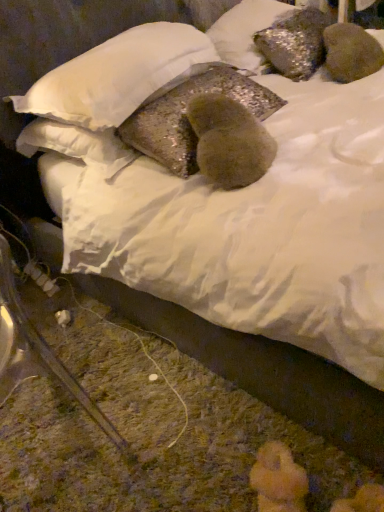
What are the coordinates of `glittery fabric pillow at center, the 3th pillow in the top-to-bottom sequence` in the screenshot? It's located at (186, 118).

Image resolution: width=384 pixels, height=512 pixels. In order to click on sparkly metallic pillow at upper center, which is counted as the 1th pillow, starting from the top in this screenshot , I will do `click(245, 32)`.

Considering the relative positions of sparkly metallic pillow at upper center, the 3th pillow positioned from the bottom, and shiny metallic pillow at center, the 2th pillow when ordered from top to bottom, in the image provided, is sparkly metallic pillow at upper center, the 3th pillow positioned from the bottom, behind shiny metallic pillow at center, the 2th pillow when ordered from top to bottom,?

Yes, sparkly metallic pillow at upper center, the 3th pillow positioned from the bottom, is further from the camera.

Does sparkly metallic pillow at upper center, the 3th pillow positioned from the bottom, have a lesser width compared to shiny metallic pillow at center, which is the second pillow from bottom to top?

Yes.

From a real-world perspective, is sparkly metallic pillow at upper center, which is counted as the 1th pillow, starting from the top, physically located above or below shiny metallic pillow at center, the 2th pillow when ordered from top to bottom?

sparkly metallic pillow at upper center, which is counted as the 1th pillow, starting from the top, is situated lower than shiny metallic pillow at center, the 2th pillow when ordered from top to bottom, in the real world.

Considering the sizes of objects sparkly metallic pillow at upper center, the 3th pillow positioned from the bottom, and shiny metallic pillow at center, the 2th pillow when ordered from top to bottom, in the image provided, who is shorter, sparkly metallic pillow at upper center, the 3th pillow positioned from the bottom, or shiny metallic pillow at center, the 2th pillow when ordered from top to bottom,?

With less height is shiny metallic pillow at center, the 2th pillow when ordered from top to bottom.

Is sparkly metallic pillow at upper center, the 3th pillow positioned from the bottom, thinner than glittery fabric pillow at center, marked as the first pillow in a bottom-to-top arrangement?

In fact, sparkly metallic pillow at upper center, the 3th pillow positioned from the bottom, might be wider than glittery fabric pillow at center, marked as the first pillow in a bottom-to-top arrangement.

Is sparkly metallic pillow at upper center, which is counted as the 1th pillow, starting from the top, positioned with its back to glittery fabric pillow at center, the 3th pillow in the top-to-bottom sequence?

No, sparkly metallic pillow at upper center, which is counted as the 1th pillow, starting from the top, is not facing away from glittery fabric pillow at center, the 3th pillow in the top-to-bottom sequence.

Which point is more forward, (x=239, y=55) or (x=167, y=93)?

The point (x=167, y=93) is more forward.

Which of these two, sparkly metallic pillow at upper center, which is counted as the 1th pillow, starting from the top, or glittery fabric pillow at center, the 3th pillow in the top-to-bottom sequence, is smaller?

glittery fabric pillow at center, the 3th pillow in the top-to-bottom sequence, is smaller.

Does point (232, 89) lie behind point (82, 123)?

Yes.

From their relative heights in the image, would you say glittery fabric pillow at center, marked as the first pillow in a bottom-to-top arrangement, is taller or shorter than shiny metallic pillow at center, the 2th pillow when ordered from top to bottom?

Considering their sizes, glittery fabric pillow at center, marked as the first pillow in a bottom-to-top arrangement, has more height than shiny metallic pillow at center, the 2th pillow when ordered from top to bottom.

Between glittery fabric pillow at center, marked as the first pillow in a bottom-to-top arrangement, and shiny metallic pillow at center, which is the second pillow from bottom to top, which one is positioned behind?

glittery fabric pillow at center, marked as the first pillow in a bottom-to-top arrangement, is further away from the camera.

Can we say glittery fabric pillow at center, the 3th pillow in the top-to-bottom sequence, lies outside shiny metallic pillow at center, which is the second pillow from bottom to top?

Absolutely, glittery fabric pillow at center, the 3th pillow in the top-to-bottom sequence, is external to shiny metallic pillow at center, which is the second pillow from bottom to top.

From the image's perspective, is shiny metallic pillow at center, which is the second pillow from bottom to top, on top of glittery fabric pillow at center, marked as the first pillow in a bottom-to-top arrangement?

Indeed, from the image's perspective, shiny metallic pillow at center, which is the second pillow from bottom to top, is shown above glittery fabric pillow at center, marked as the first pillow in a bottom-to-top arrangement.

Is shiny metallic pillow at center, the 2th pillow when ordered from top to bottom, outside of glittery fabric pillow at center, the 3th pillow in the top-to-bottom sequence?

That's correct, shiny metallic pillow at center, the 2th pillow when ordered from top to bottom, is outside of glittery fabric pillow at center, the 3th pillow in the top-to-bottom sequence.

Considering the relative positions of shiny metallic pillow at center, which is the second pillow from bottom to top, and glittery fabric pillow at center, marked as the first pillow in a bottom-to-top arrangement, in the image provided, is shiny metallic pillow at center, which is the second pillow from bottom to top, in front of glittery fabric pillow at center, marked as the first pillow in a bottom-to-top arrangement,?

Yes, shiny metallic pillow at center, which is the second pillow from bottom to top, is in front of glittery fabric pillow at center, marked as the first pillow in a bottom-to-top arrangement.

From the image's perspective, which is above, shiny metallic pillow at center, which is the second pillow from bottom to top, or sparkly metallic pillow at upper center, the 3th pillow positioned from the bottom?

sparkly metallic pillow at upper center, the 3th pillow positioned from the bottom, appears higher in the image.

Does shiny metallic pillow at center, the 2th pillow when ordered from top to bottom, turn towards sparkly metallic pillow at upper center, which is counted as the 1th pillow, starting from the top?

No, shiny metallic pillow at center, the 2th pillow when ordered from top to bottom, does not turn towards sparkly metallic pillow at upper center, which is counted as the 1th pillow, starting from the top.

From a real-world perspective, is shiny metallic pillow at center, the 2th pillow when ordered from top to bottom, over sparkly metallic pillow at upper center, the 3th pillow positioned from the bottom?

Indeed, from a real-world perspective, shiny metallic pillow at center, the 2th pillow when ordered from top to bottom, stands above sparkly metallic pillow at upper center, the 3th pillow positioned from the bottom.

Is shiny metallic pillow at center, the 2th pillow when ordered from top to bottom, directly adjacent to sparkly metallic pillow at upper center, which is counted as the 1th pillow, starting from the top?

No, shiny metallic pillow at center, the 2th pillow when ordered from top to bottom, is not with sparkly metallic pillow at upper center, which is counted as the 1th pillow, starting from the top.

Is glittery fabric pillow at center, the 3th pillow in the top-to-bottom sequence, touching sparkly metallic pillow at upper center, the 3th pillow positioned from the bottom?

No, glittery fabric pillow at center, the 3th pillow in the top-to-bottom sequence, is not with sparkly metallic pillow at upper center, the 3th pillow positioned from the bottom.

Which is correct: glittery fabric pillow at center, the 3th pillow in the top-to-bottom sequence, is inside sparkly metallic pillow at upper center, the 3th pillow positioned from the bottom, or outside of it?

glittery fabric pillow at center, the 3th pillow in the top-to-bottom sequence, cannot be found inside sparkly metallic pillow at upper center, the 3th pillow positioned from the bottom.

From the image's perspective, relative to sparkly metallic pillow at upper center, the 3th pillow positioned from the bottom, is glittery fabric pillow at center, the 3th pillow in the top-to-bottom sequence, above or below?

Based on their image positions, glittery fabric pillow at center, the 3th pillow in the top-to-bottom sequence, is located beneath sparkly metallic pillow at upper center, the 3th pillow positioned from the bottom.

Considering the positions of objects glittery fabric pillow at center, marked as the first pillow in a bottom-to-top arrangement, and sparkly metallic pillow at upper center, the 3th pillow positioned from the bottom, in the image provided, who is more to the right, glittery fabric pillow at center, marked as the first pillow in a bottom-to-top arrangement, or sparkly metallic pillow at upper center, the 3th pillow positioned from the bottom,?

sparkly metallic pillow at upper center, the 3th pillow positioned from the bottom.

You are a GUI agent. You are given a task and a screenshot of the screen. Output one action in this format:
    pyautogui.click(x=<x>, y=<y>)
    Task: Click on the 2nd pillow behind the shiny metallic pillow at center, which is the second pillow from bottom to top, counting from the anchor's position
    Image resolution: width=384 pixels, height=512 pixels.
    Given the screenshot: What is the action you would take?
    pyautogui.click(x=245, y=32)

There is a glittery fabric pillow at center, marked as the first pillow in a bottom-to-top arrangement. Identify the location of the 1st pillow above it (from a real-world perspective). The width and height of the screenshot is (384, 512). (245, 32).

From the image, which object appears to be farther from sparkly metallic pillow at upper center, the 3th pillow positioned from the bottom, shiny metallic pillow at center, the 2th pillow when ordered from top to bottom, or glittery fabric pillow at center, marked as the first pillow in a bottom-to-top arrangement?

shiny metallic pillow at center, the 2th pillow when ordered from top to bottom, is positioned further to the anchor sparkly metallic pillow at upper center, the 3th pillow positioned from the bottom.

Looking at the image, which one is located further to shiny metallic pillow at center, which is the second pillow from bottom to top, glittery fabric pillow at center, the 3th pillow in the top-to-bottom sequence, or sparkly metallic pillow at upper center, the 3th pillow positioned from the bottom?

sparkly metallic pillow at upper center, the 3th pillow positioned from the bottom, is further to shiny metallic pillow at center, which is the second pillow from bottom to top.

Considering their positions, is glittery fabric pillow at center, marked as the first pillow in a bottom-to-top arrangement, positioned closer to sparkly metallic pillow at upper center, the 3th pillow positioned from the bottom, than shiny metallic pillow at center, which is the second pillow from bottom to top?

The object closer to sparkly metallic pillow at upper center, the 3th pillow positioned from the bottom, is glittery fabric pillow at center, marked as the first pillow in a bottom-to-top arrangement.

When comparing their distances from shiny metallic pillow at center, which is the second pillow from bottom to top, does sparkly metallic pillow at upper center, the 3th pillow positioned from the bottom, or glittery fabric pillow at center, marked as the first pillow in a bottom-to-top arrangement, seem closer?

glittery fabric pillow at center, marked as the first pillow in a bottom-to-top arrangement, is positioned closer to the anchor shiny metallic pillow at center, which is the second pillow from bottom to top.

Based on their spatial positions, is sparkly metallic pillow at upper center, which is counted as the 1th pillow, starting from the top, or shiny metallic pillow at center, the 2th pillow when ordered from top to bottom, closer to glittery fabric pillow at center, marked as the first pillow in a bottom-to-top arrangement?

shiny metallic pillow at center, the 2th pillow when ordered from top to bottom, lies closer to glittery fabric pillow at center, marked as the first pillow in a bottom-to-top arrangement, than the other object.

Estimate the real-world distances between objects in this image. Which object is further from glittery fabric pillow at center, marked as the first pillow in a bottom-to-top arrangement, shiny metallic pillow at center, the 2th pillow when ordered from top to bottom, or sparkly metallic pillow at upper center, which is counted as the 1th pillow, starting from the top?

The object further to glittery fabric pillow at center, marked as the first pillow in a bottom-to-top arrangement, is sparkly metallic pillow at upper center, which is counted as the 1th pillow, starting from the top.

At what (x,y) coordinates should I click in order to perform the action: click on pillow positioned between shiny metallic pillow at center, the 2th pillow when ordered from top to bottom, and sparkly metallic pillow at upper center, the 3th pillow positioned from the bottom, from near to far. Please return your answer as a coordinate pair (x, y). The height and width of the screenshot is (512, 384). Looking at the image, I should click on (186, 118).